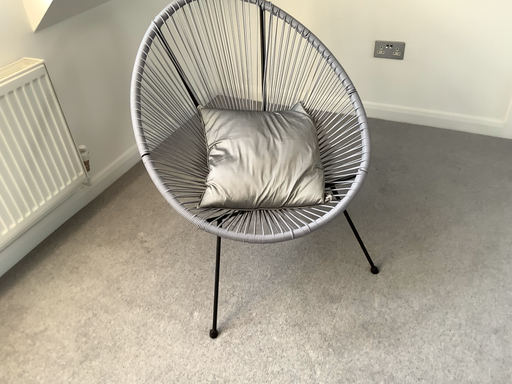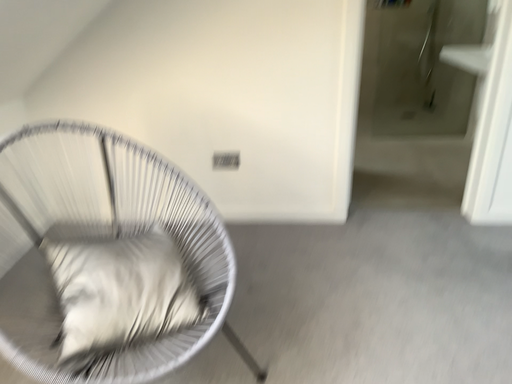
Question: How did the camera likely rotate when shooting the video?

Choices:
 (A) rotated left
 (B) rotated right

Answer: (B)